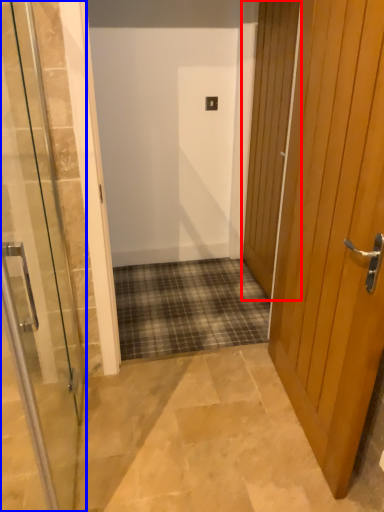
Question: Which point is closer to the camera, door (highlighted by a red box) or door (highlighted by a blue box)?

Choices:
 (A) door
 (B) door

Answer: (B)